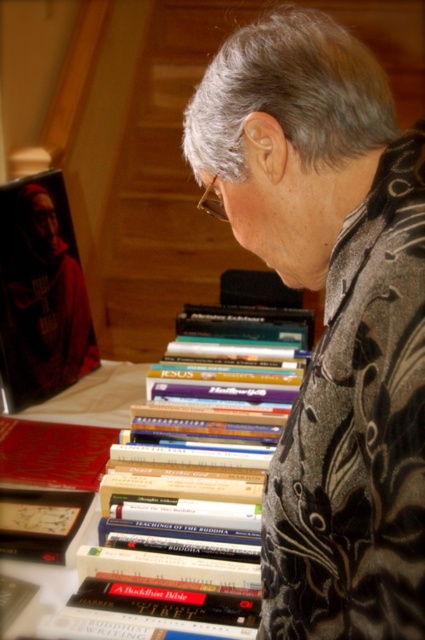
Question: Which point is closer to the camera?

Choices:
 (A) matte black book at left
 (B) hardcover book at center

Answer: (B)

Question: In this image, where is hardcover book at center located relative to matte black book at left?

Choices:
 (A) right
 (B) left

Answer: (A)

Question: Which point is farther to the camera?

Choices:
 (A) (221, 212)
 (B) (345, 129)
 (C) (93, 326)

Answer: (C)

Question: Does black textured jacket at center have a lesser width compared to clear plastic glasses at upper center?

Choices:
 (A) no
 (B) yes

Answer: (A)

Question: Does matte black book at left have a lesser width compared to clear plastic glasses at upper center?

Choices:
 (A) yes
 (B) no

Answer: (B)

Question: Which point is farther to the camera?

Choices:
 (A) (53, 275)
 (B) (342, 209)
 (C) (127, 564)

Answer: (A)